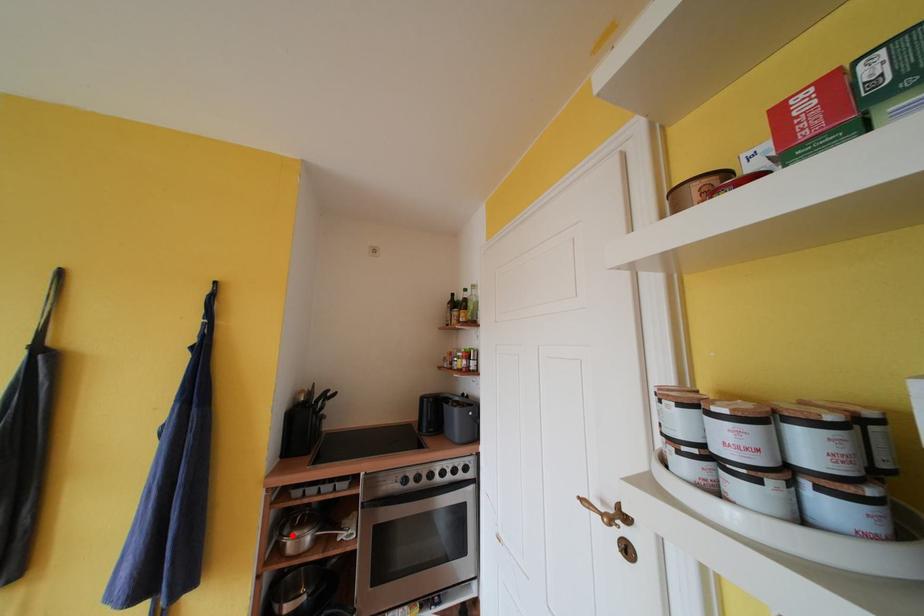
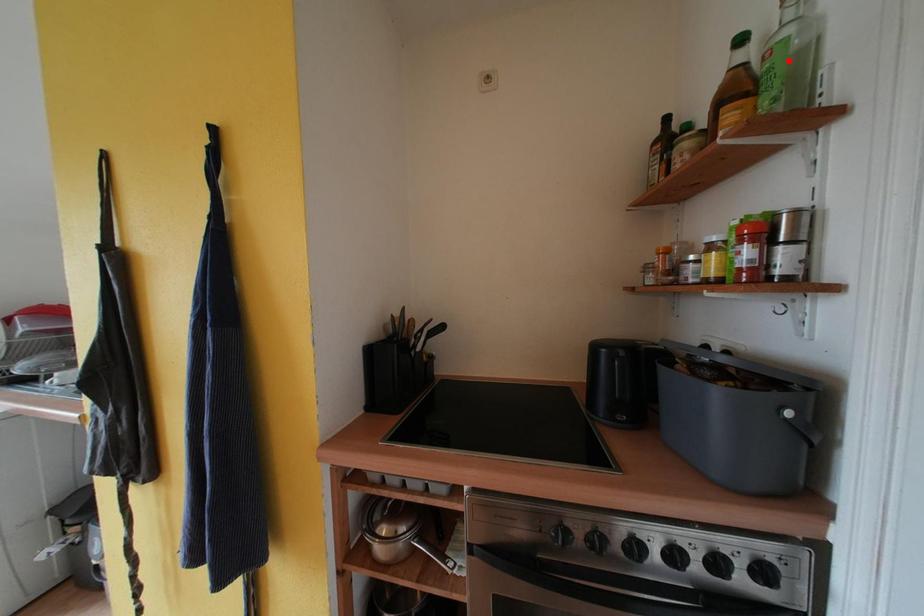
I am providing you with two images of the same scene from different viewpoints. A red point is marked on the first image and another point is marked on the second image. Is the red point in image1 aligned with the point shown in image2?

No